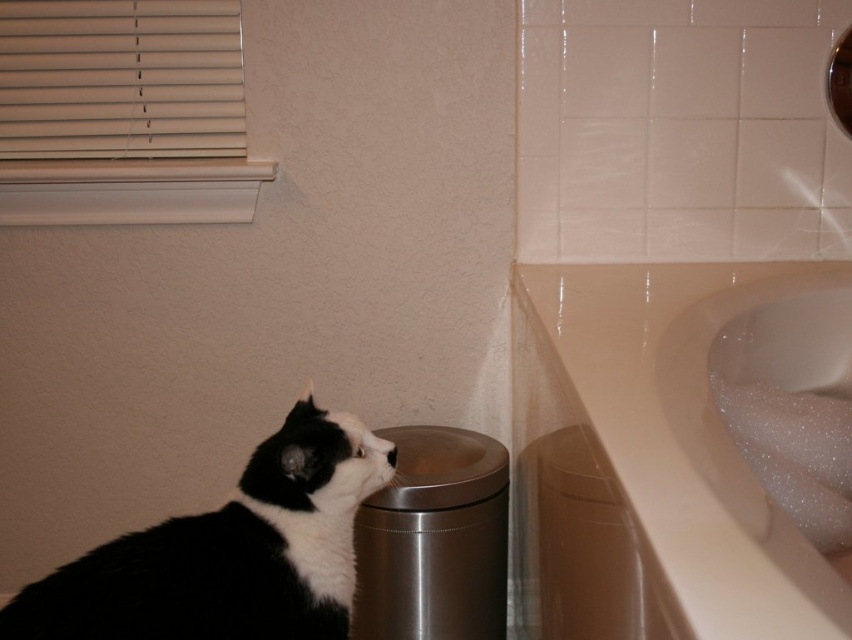
Is point (585, 476) positioned before point (295, 484)?

Yes, it is in front of point (295, 484).

From the picture: Between white glossy sink at upper right and black and white fur at lower left, which one has less height?

black and white fur at lower left is shorter.

Between point (781, 531) and point (248, 580), which one is positioned behind?

Positioned behind is point (248, 580).

Locate an element on the screen. Image resolution: width=852 pixels, height=640 pixels. white glossy sink at upper right is located at coordinates (649, 461).